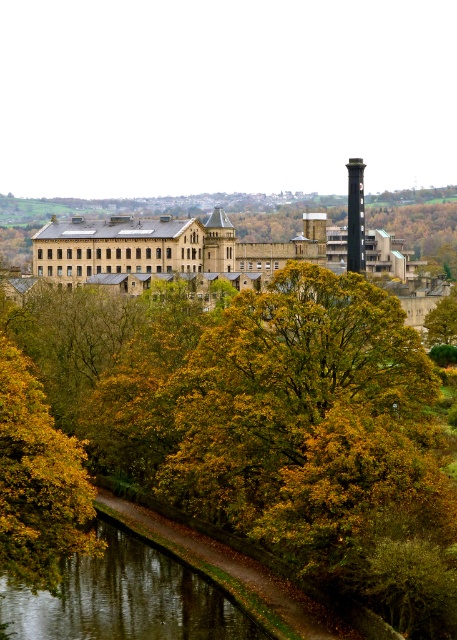
You are standing on the bank of the canal and want to take a photo of the historic building. Which object, the reflective smooth water at lower left or the smooth gray chimney at center, would appear larger in your camera view?

The reflective smooth water at lower left is closer to the viewer than the smooth gray chimney at center, so it would appear larger in the camera view.